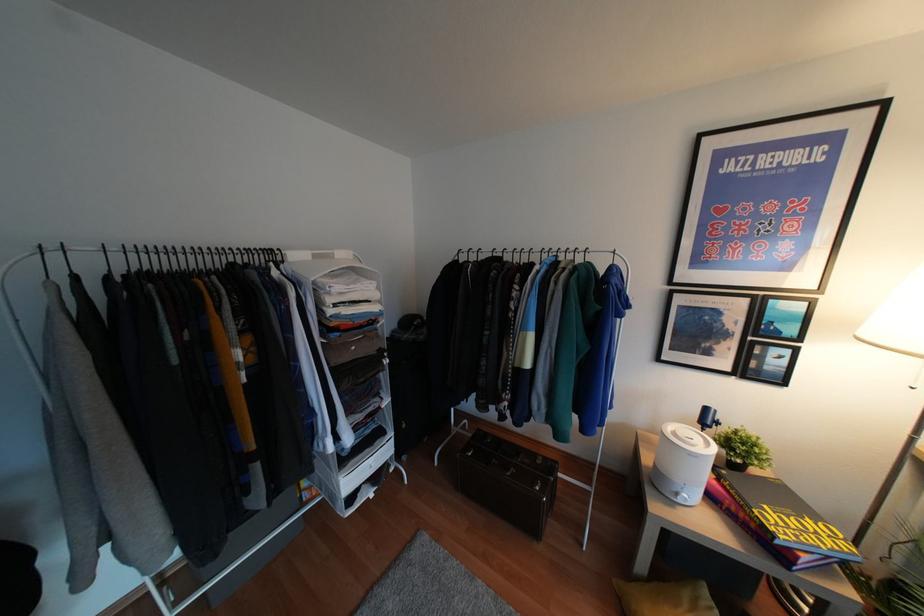
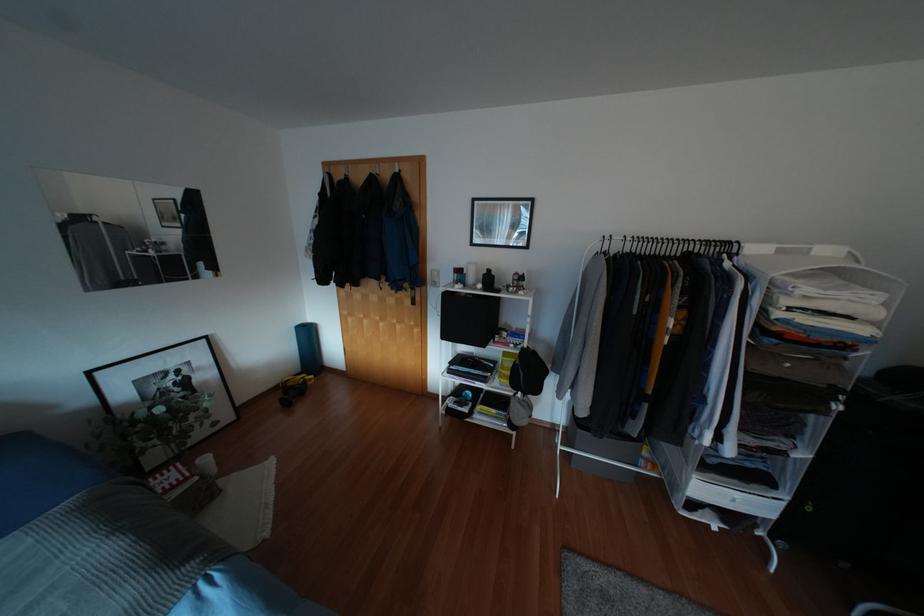
Find the pixel in the second image that matches point 313,256 in the first image.

(779, 251)